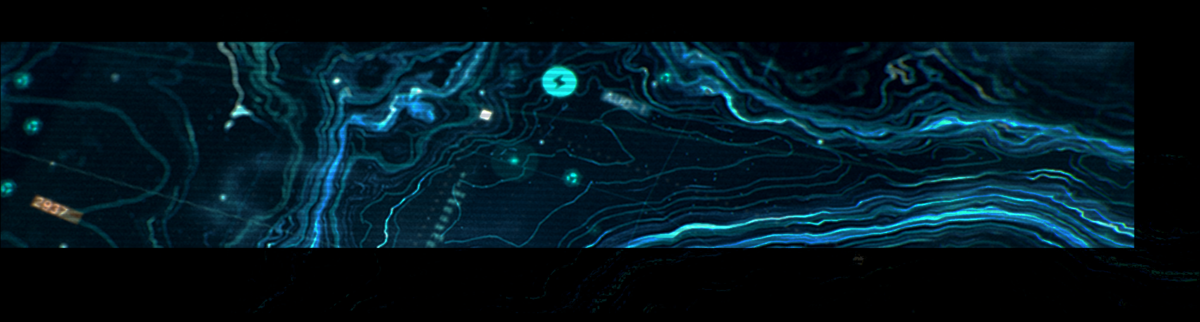
You are a GUI agent. You are given a task and a screenshot of the screen. Output one action in this format:
    pyautogui.click(x=<x>, y=<y>)
    Task: Click on the light circle with white light
    
    Given the screenshot: What is the action you would take?
    pyautogui.click(x=511, y=174)